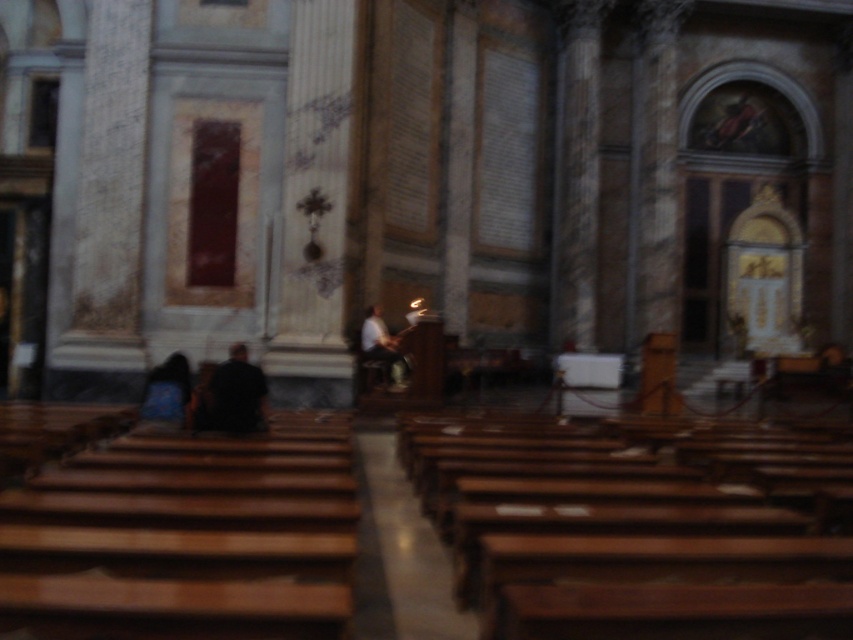
Is black matte shirt at center smaller than blue fabric bag at lower left?

Yes, black matte shirt at center is smaller than blue fabric bag at lower left.

Between black matte shirt at center and blue fabric bag at lower left, which one has more height?

Standing taller between the two is blue fabric bag at lower left.

Does point (233, 396) lie behind point (149, 394)?

No, (233, 396) is in front of (149, 394).

The image size is (853, 640). Identify the location of black matte shirt at center. (236, 394).

This screenshot has height=640, width=853. What do you see at coordinates (167, 390) in the screenshot?
I see `blue fabric bag at lower left` at bounding box center [167, 390].

You are a GUI agent. You are given a task and a screenshot of the screen. Output one action in this format:
    pyautogui.click(x=<x>, y=<y>)
    Task: Click on the blue fabric bag at lower left
    The image size is (853, 640).
    Given the screenshot: What is the action you would take?
    pyautogui.click(x=167, y=390)

Locate an element on the screen. blue fabric bag at lower left is located at coordinates (167, 390).

Can you confirm if black matte shirt at center is bigger than white matte shirt at center?

Incorrect, black matte shirt at center is not larger than white matte shirt at center.

In order to click on black matte shirt at center in this screenshot , I will do pos(236,394).

Find the location of `black matte shirt at center`. black matte shirt at center is located at coordinates (236, 394).